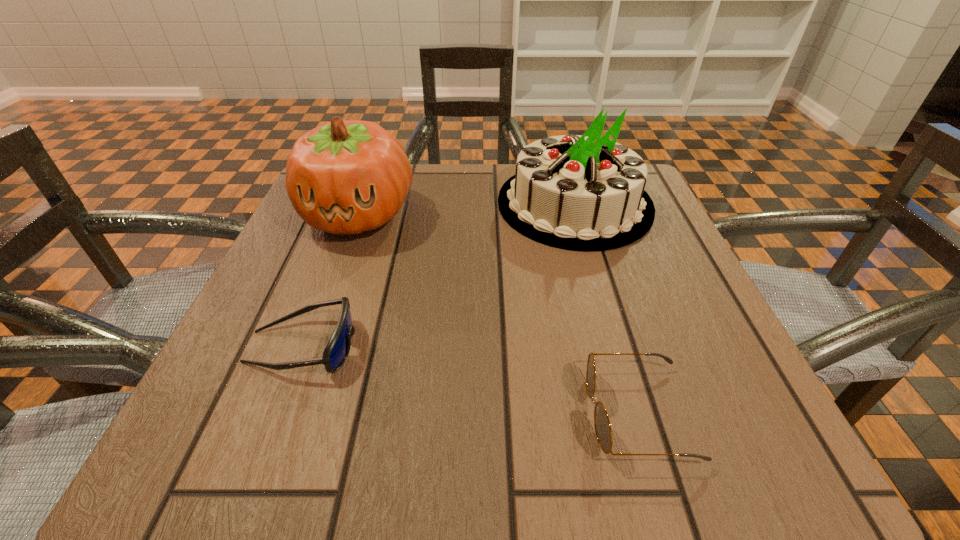
Locate an element on the screen. The image size is (960, 540). birthday cake positioned at the far edge is located at coordinates (585, 193).

Locate an element on the screen. This screenshot has width=960, height=540. pumpkin that is at the far edge is located at coordinates (345, 177).

Where is `object that is at the near edge`? The height and width of the screenshot is (540, 960). object that is at the near edge is located at coordinates (603, 430).

The image size is (960, 540). In order to click on pumpkin located at the left edge in this screenshot , I will do `click(345, 177)`.

The width and height of the screenshot is (960, 540). I want to click on sunglasses situated at the left edge, so click(337, 350).

The height and width of the screenshot is (540, 960). Identify the location of birthday cake situated at the right edge. (585, 193).

Find the location of `sunglasses that is at the right edge`. sunglasses that is at the right edge is located at coordinates (603, 430).

Where is `object that is at the far left corner`? object that is at the far left corner is located at coordinates (345, 177).

Where is `object present at the far right corner`? This screenshot has height=540, width=960. object present at the far right corner is located at coordinates (585, 193).

Find the location of a particular element. Image resolution: width=960 pixels, height=540 pixels. object located at the near right corner is located at coordinates (603, 430).